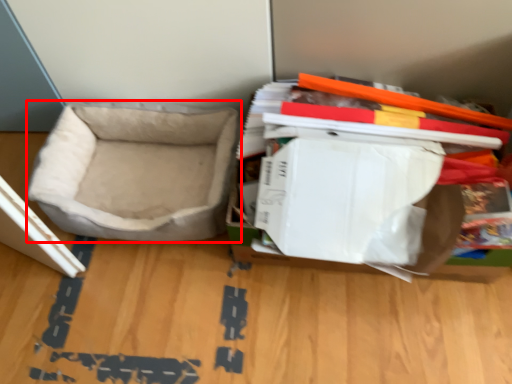
Question: Where is dog bed (annotated by the red box) located in relation to storage box in the image?

Choices:
 (A) left
 (B) right

Answer: (A)